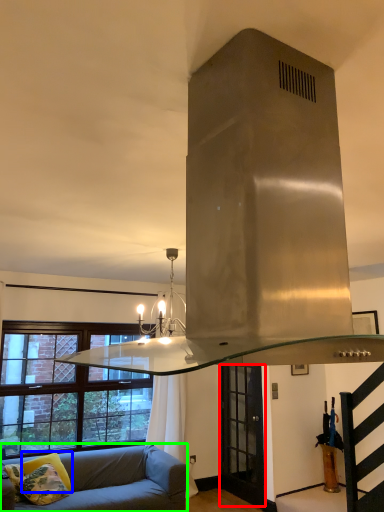
Question: Based on their relative distances, which object is nearer to glass door (highlighted by a red box)? Choose from pillow (highlighted by a blue box) and studio couch (highlighted by a green box).

Choices:
 (A) pillow
 (B) studio couch

Answer: (B)